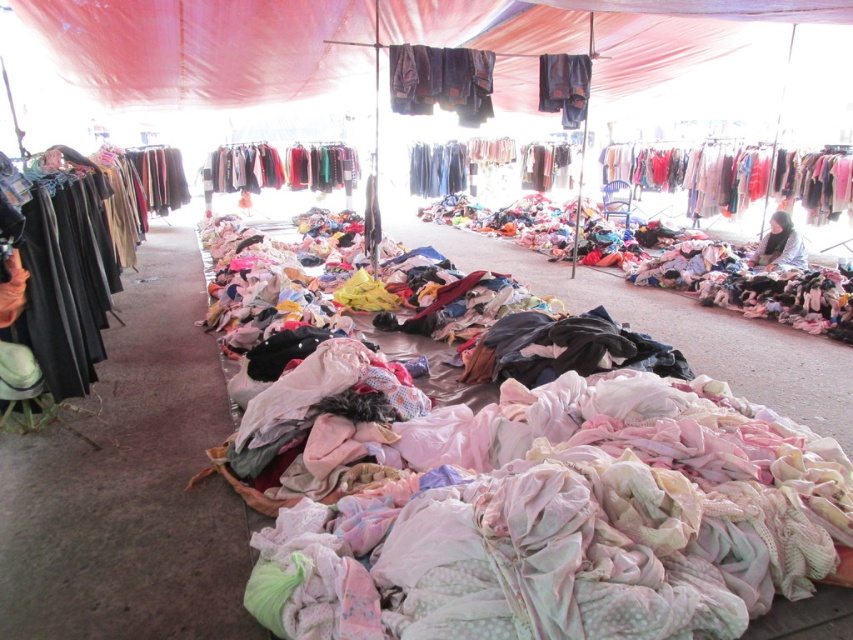
You are a customer standing at the entrance of the market and want to reach the dark blue jeans at center. The canopy is in the way. Can you walk under the matte red fabric canopy at upper center to get to the jeans?

The matte red fabric canopy at upper center and dark blue jeans at center are 8.17 feet apart from each other. Since the canopy is overhead, you can walk under the matte red fabric canopy at upper center to reach the dark blue jeans at center as the distance is sufficient for passage.

You are a customer at the outdoor clothing market. You want to buy the dark blue jeans at center but are concerned about the weather. Is the matte red fabric canopy at upper center large enough to protect you from the rain?

The matte red fabric canopy at upper center is smaller than the dark blue jeans at center, so it may not provide sufficient coverage to protect you from the rain.

You are a customer at the outdoor clothing market. You want to buy a larger item for a big event. Which item between the pastel cotton shirts at right and the dark blue jeans at center should you choose?

The pastel cotton shirts at right are larger in size than the dark blue jeans at center, so you should choose the pastel cotton shirts at right for a big event.